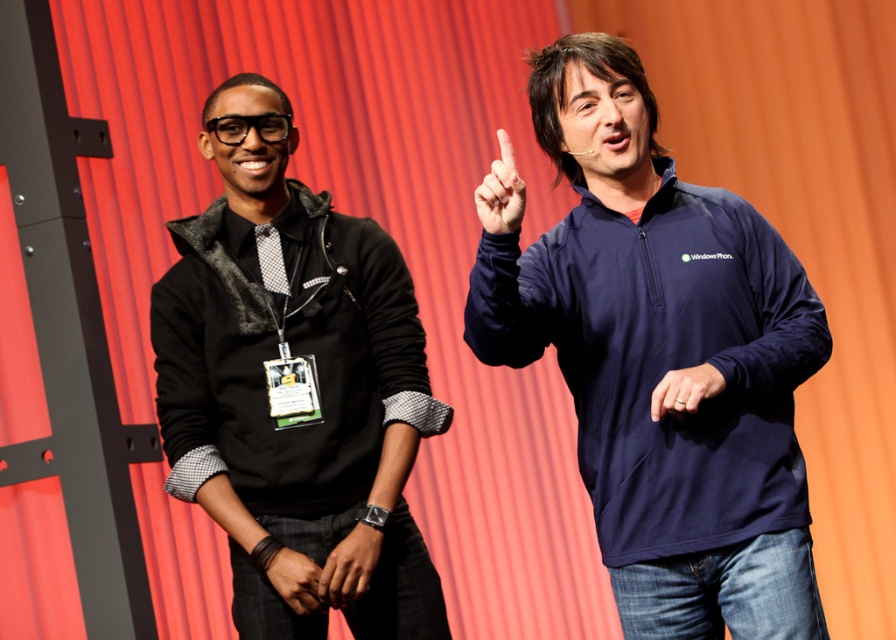
Is black fleece jacket at left thinner than matte blue finger at center?

Incorrect, black fleece jacket at left's width is not less than matte blue finger at center's.

Does point (319, 435) come closer to viewer compared to point (501, 170)?

No, (319, 435) is further to viewer.

Where is `black fleece jacket at left`? black fleece jacket at left is located at coordinates (295, 385).

Does black fleece jacket at left have a greater height compared to matte black wristband at lower center?

Yes, black fleece jacket at left is taller than matte black wristband at lower center.

Does black fleece jacket at left have a larger size compared to matte black wristband at lower center?

Indeed, black fleece jacket at left has a larger size compared to matte black wristband at lower center.

Between point (188, 326) and point (289, 564), which one is positioned behind?

Point (188, 326)

Locate an element on the screen. This screenshot has width=896, height=640. black fleece jacket at left is located at coordinates (295, 385).

Who is more forward, (535, 296) or (488, 230)?

Point (488, 230) is more forward.

Does navy blue fleece at center appear under matte blue finger at center?

Correct, navy blue fleece at center is located below matte blue finger at center.

Is point (621, 586) in front of point (500, 170)?

That is False.

Locate an element on the screen. The height and width of the screenshot is (640, 896). navy blue fleece at center is located at coordinates (662, 358).